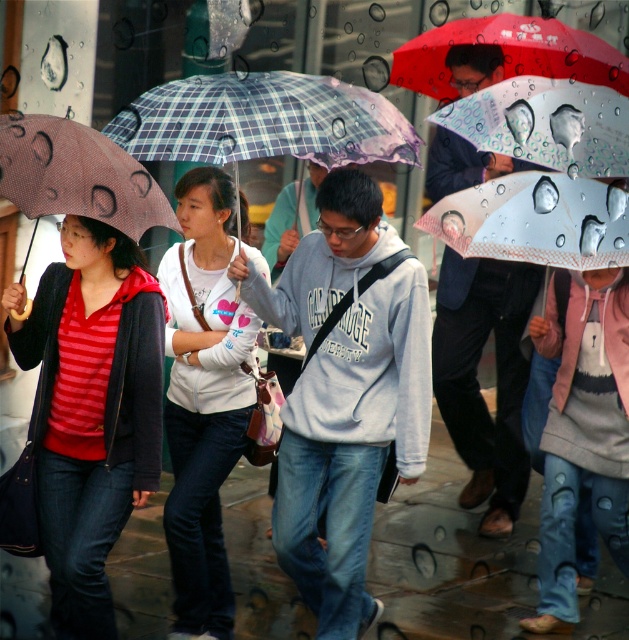
Looking at this image, you are a delivery robot with a 1 meter wide package. You need to move between the gray fleece sweatshirt at center and the matte brown umbrella at left. Can you fit through the space between them?

The distance between the gray fleece sweatshirt at center and the matte brown umbrella at left is 1.13 meters, so yes, the robot can fit through the space as it is wider than the package.

You are standing in the middle of the street and see the plaid fabric umbrella at center and the matte brown umbrella at left. Which umbrella is closer to you?

The plaid fabric umbrella at center is closer to you because it is further to the viewer than the matte brown umbrella at left.